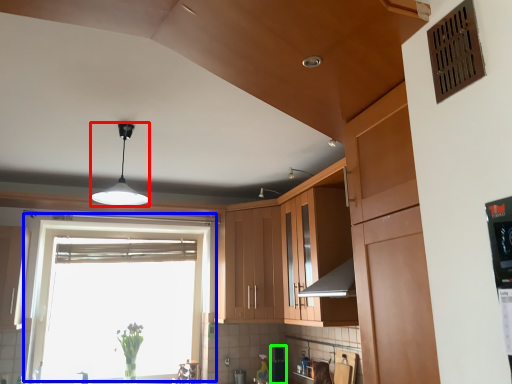
Question: Which object is the farthest from light fixture (highlighted by a red box)? Choose among these: window (highlighted by a blue box) or appliance (highlighted by a green box).

Choices:
 (A) window
 (B) appliance

Answer: (A)